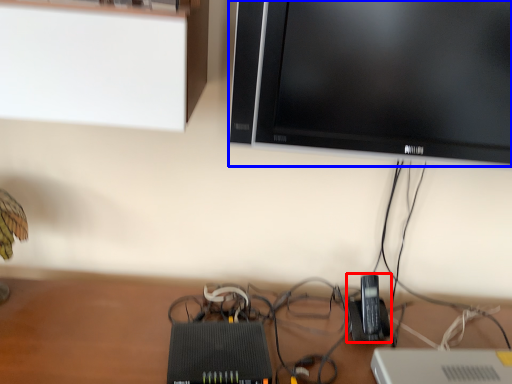
Question: Which object is further to the camera taking this photo, gadget (highlighted by a red box) or television (highlighted by a blue box)?

Choices:
 (A) gadget
 (B) television

Answer: (A)